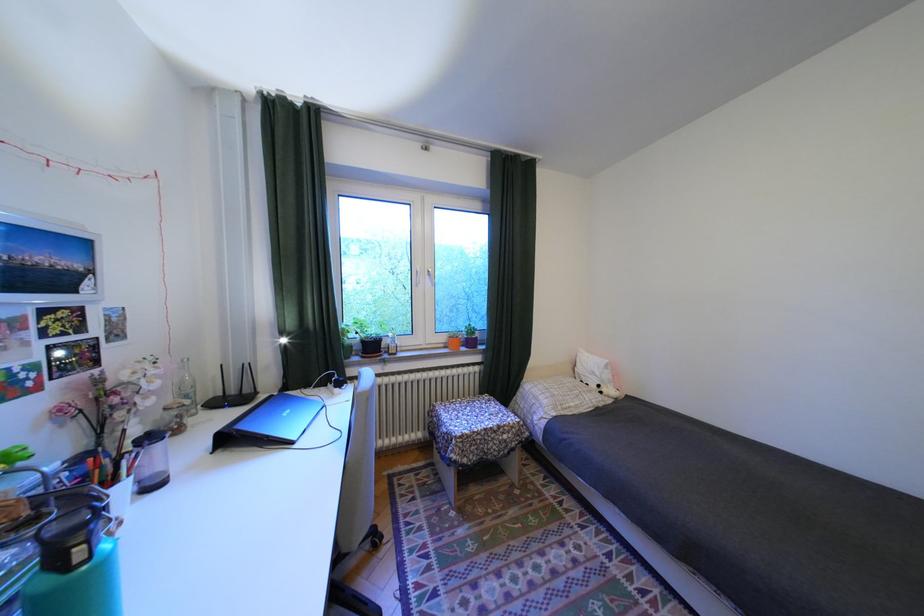
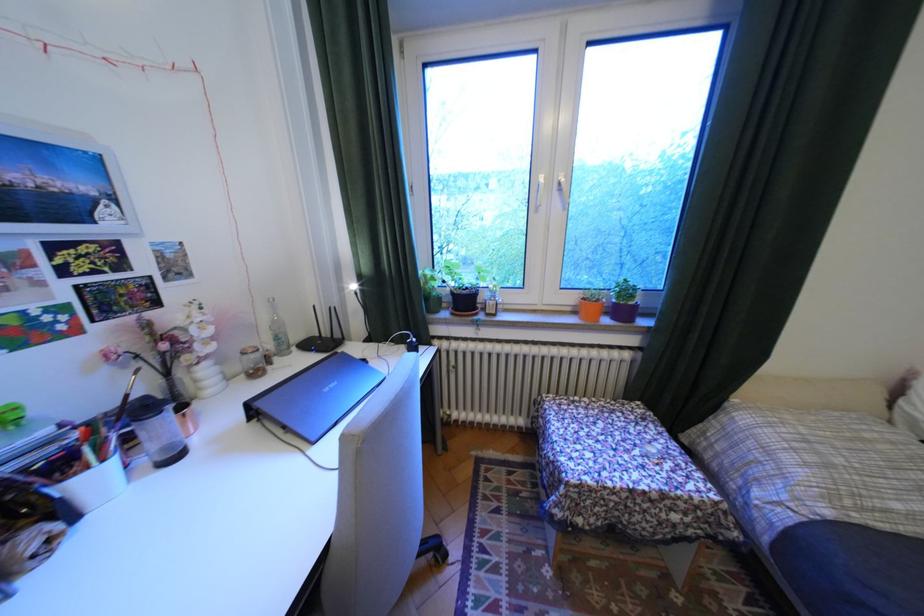
Find the pixel in the second image that matches (439,277) in the first image.

(566, 195)